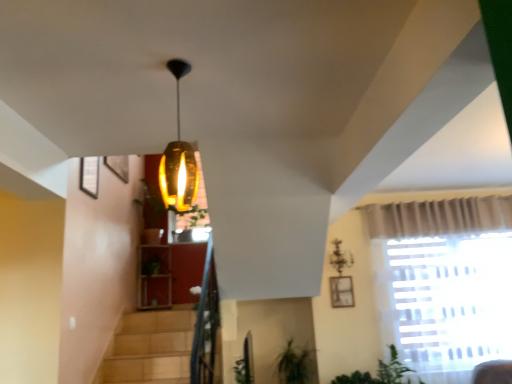
Question: Relative to wooden frame at upper right, is metallic chandelier at upper center in front or behind?

Choices:
 (A) behind
 (B) front

Answer: (B)

Question: From a real-world perspective, relative to wooden frame at upper right, is metallic chandelier at upper center vertically above or below?

Choices:
 (A) above
 (B) below

Answer: (A)

Question: Is metallic chandelier at upper center wider or thinner than wooden frame at upper right?

Choices:
 (A) wide
 (B) thin

Answer: (A)

Question: Is wooden frame at upper right bigger or smaller than metallic chandelier at upper center?

Choices:
 (A) big
 (B) small

Answer: (B)

Question: In the image, is wooden frame at upper right on the left side or the right side of metallic chandelier at upper center?

Choices:
 (A) right
 (B) left

Answer: (A)

Question: Is wooden frame at upper right taller or shorter than metallic chandelier at upper center?

Choices:
 (A) short
 (B) tall

Answer: (A)

Question: Is wooden frame at upper right in front of or behind metallic chandelier at upper center in the image?

Choices:
 (A) front
 (B) behind

Answer: (B)